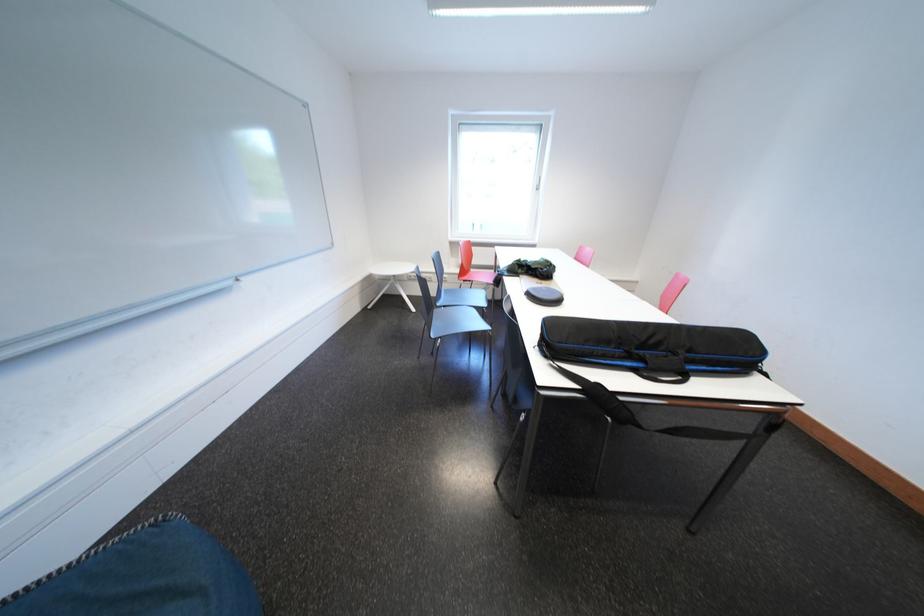
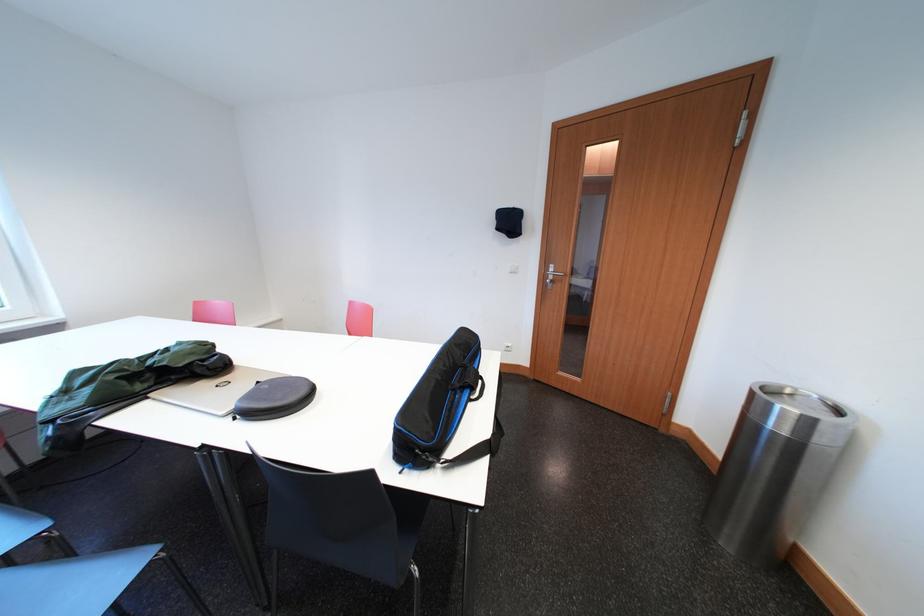
Find the pixel in the second image that matches the point at 650,370 in the first image.

(477, 395)